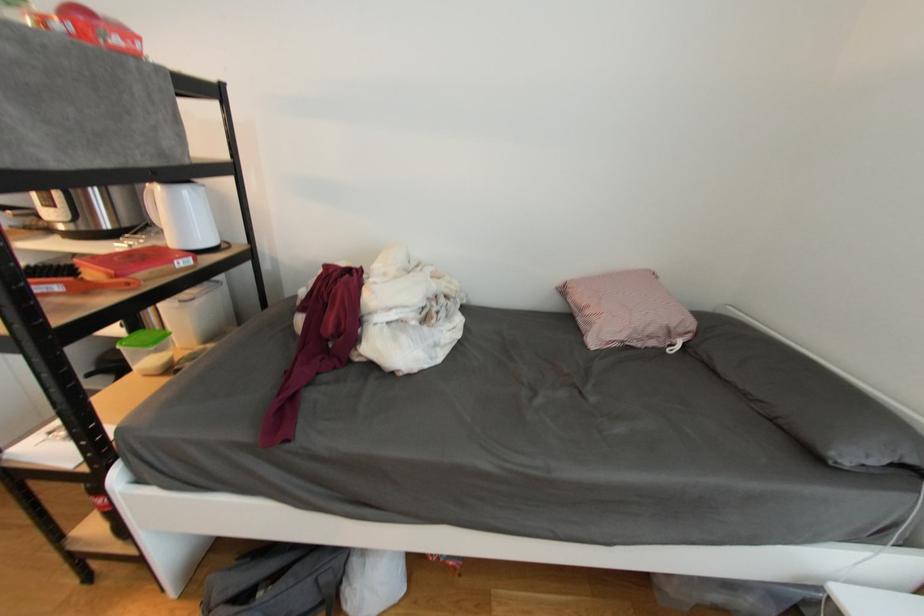
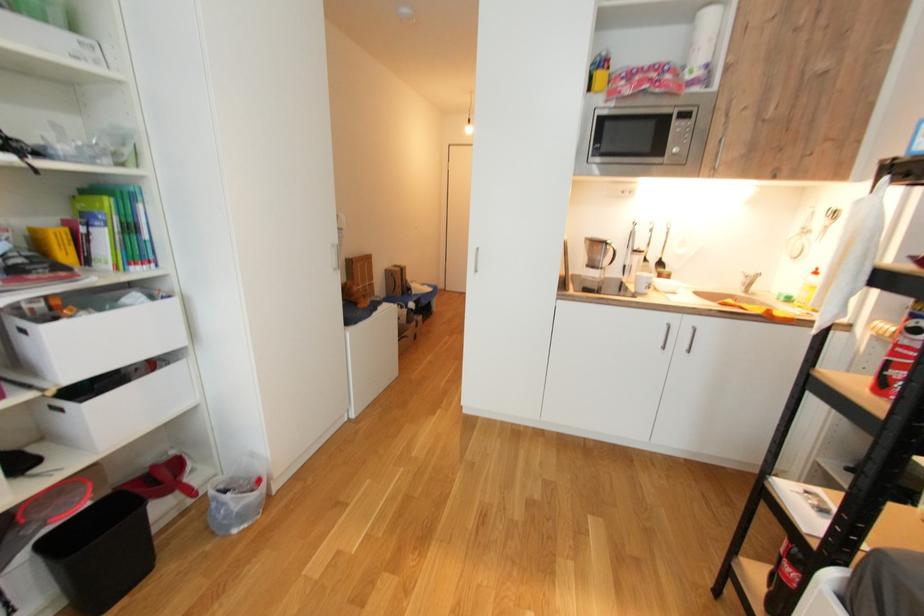
The first image is from the beginning of the video and the second image is from the end. How did the camera likely rotate when shooting the video?

The camera rotated toward left-down.